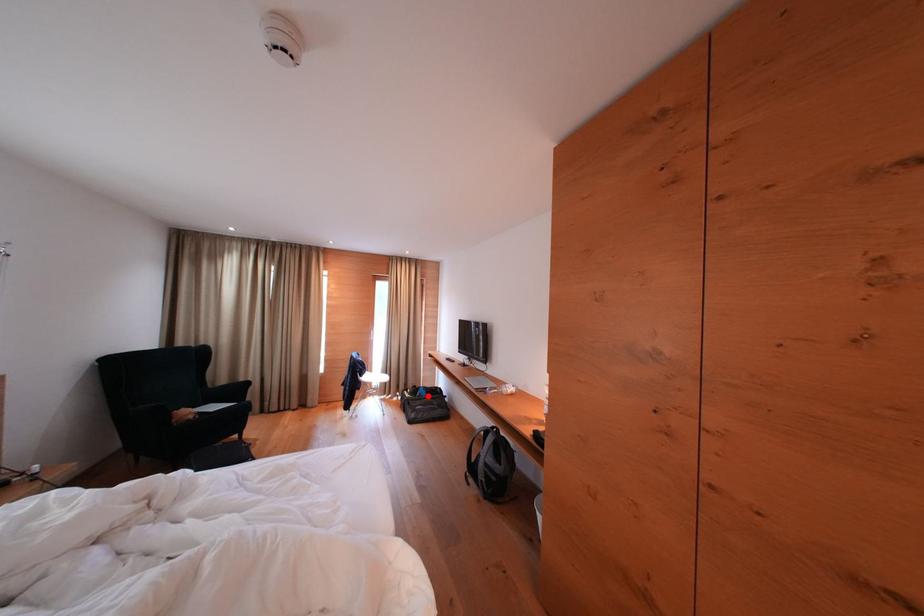
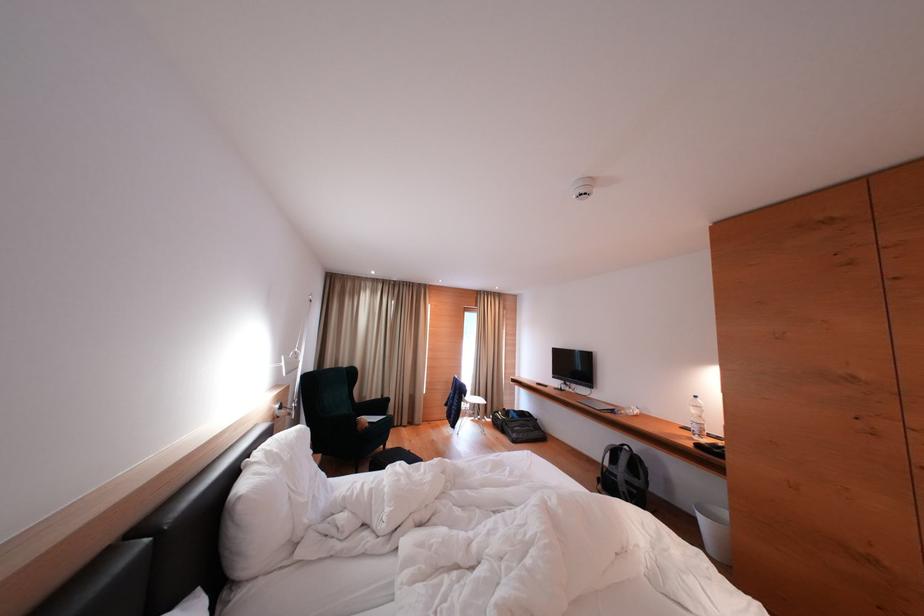
Question: I am providing you with two images of the same scene from different viewpoints. Given a red point in image1, look at the same physical point in image2. Is it:

Choices:
 (A) Closer to the viewpoint
 (B) Farther from the viewpoint

Answer: (B)